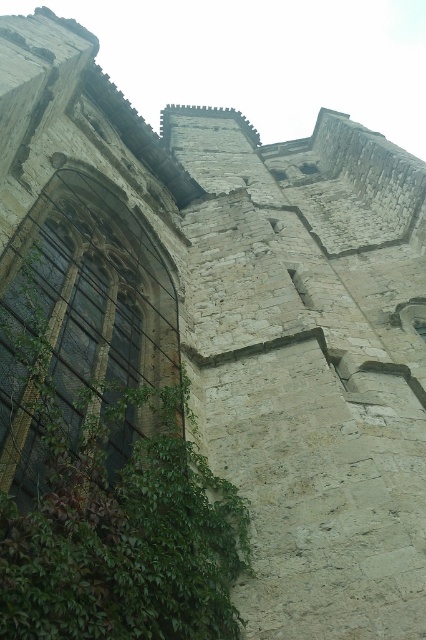
Question: Does green leafy plant at lower left appear on the right side of dark glass window at left?

Choices:
 (A) yes
 (B) no

Answer: (A)

Question: Which of the following is the farthest from the observer?

Choices:
 (A) dark glass window at left
 (B) green leafy plant at lower left

Answer: (A)

Question: Which object is closer to the camera taking this photo?

Choices:
 (A) green leafy plant at lower left
 (B) dark glass window at left

Answer: (A)

Question: Is green leafy plant at lower left positioned in front of dark glass window at left?

Choices:
 (A) yes
 (B) no

Answer: (A)

Question: Can you confirm if green leafy plant at lower left is positioned to the right of dark glass window at left?

Choices:
 (A) no
 (B) yes

Answer: (B)